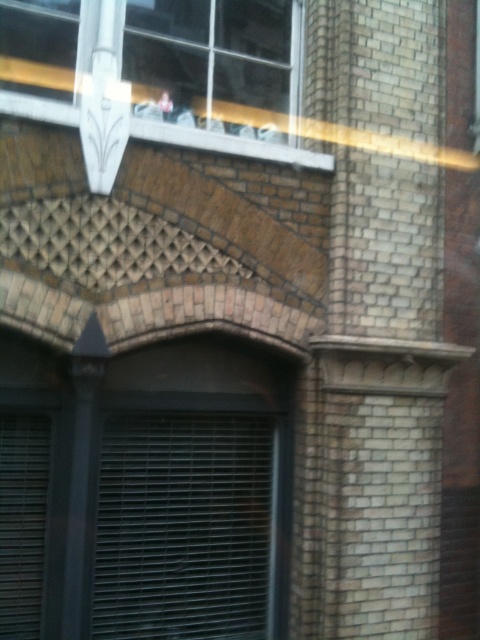
You are a window installer working on a historic building. You need to install a new clear glass window at upper center. The white textured stone at upper center is part of the building structure. What is the minimum space you must maintain between the new window and the white textured stone to ensure proper installation?

The minimum space you must maintain between the clear glass window at upper center and the white textured stone at upper center is 11.73 inches to ensure proper installation.

You are an architect examining the building facade. You notice the clear glass window at upper center and the white textured stone at upper center. Which of these two elements is positioned higher up on the wall?

The clear glass window at upper center is positioned higher up on the wall than the white textured stone at upper center because it is much taller.